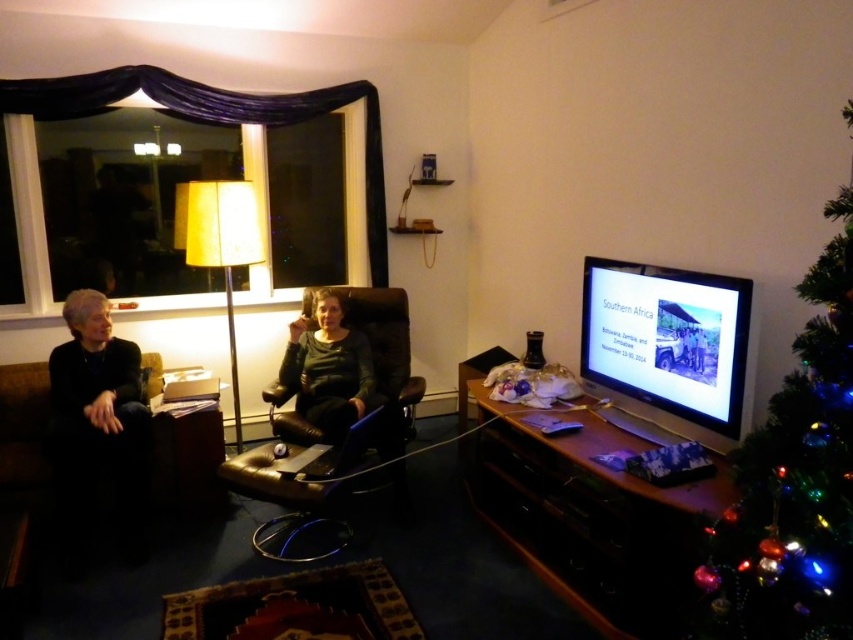
Question: Which point is farther from the camera taking this photo?

Choices:
 (A) (90, 419)
 (B) (814, 298)
 (C) (335, 426)

Answer: (C)

Question: Where is green artificial christmas tree at right located in relation to matte black chair at center in the image?

Choices:
 (A) left
 (B) right

Answer: (B)

Question: Which object appears closest to the camera in this image?

Choices:
 (A) black leather couch at left
 (B) green artificial christmas tree at right

Answer: (B)

Question: Where is black leather couch at left located in relation to matte black chair at center in the image?

Choices:
 (A) below
 (B) above

Answer: (A)

Question: Is black leather couch at left above matte black chair at center?

Choices:
 (A) no
 (B) yes

Answer: (A)

Question: Which object is the closest to the green artificial christmas tree at right?

Choices:
 (A) matte black chair at center
 (B) black leather couch at left

Answer: (A)